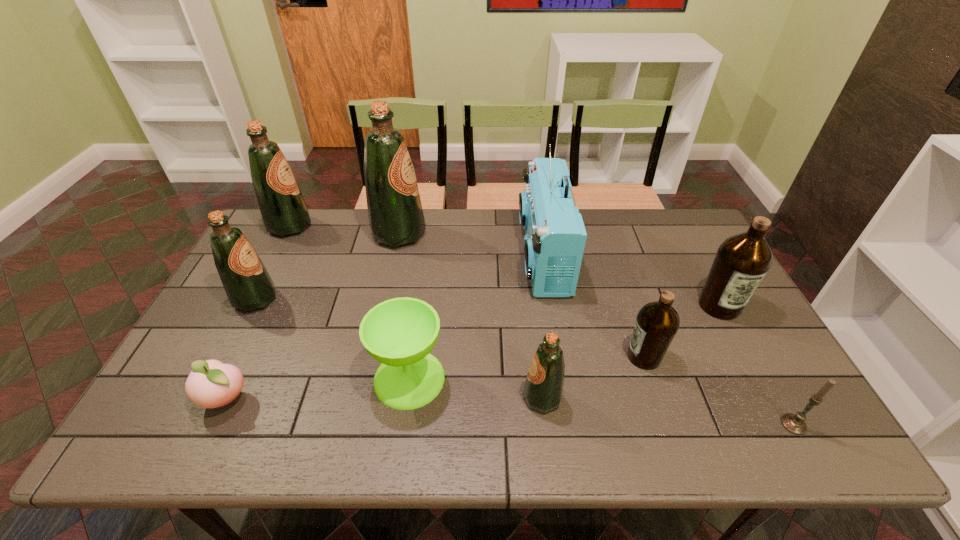
Locate an element on the screen. vacant space situated 0.140m on the back of the shortest object is located at coordinates (256, 335).

Image resolution: width=960 pixels, height=540 pixels. What are the coordinates of `radio receiver located in the far edge section of the desktop` in the screenshot? It's located at (555, 235).

The width and height of the screenshot is (960, 540). I want to click on olive oil present at the near edge, so click(x=543, y=389).

Identify the location of candle located in the near edge section of the desktop. The image size is (960, 540). (795, 424).

Locate an element on the screen. The width and height of the screenshot is (960, 540). peach that is positioned at the near edge is located at coordinates (211, 384).

Image resolution: width=960 pixels, height=540 pixels. Identify the location of peach that is at the left edge. (211, 384).

The width and height of the screenshot is (960, 540). What are the coordinates of `olive oil positioned at the right edge` in the screenshot? It's located at (742, 261).

The height and width of the screenshot is (540, 960). Identify the location of candle that is at the right edge. (795, 424).

Locate an element on the screen. This screenshot has width=960, height=540. object situated at the far left corner is located at coordinates (284, 211).

Identify the location of object that is at the near left corner. The image size is (960, 540). (211, 384).